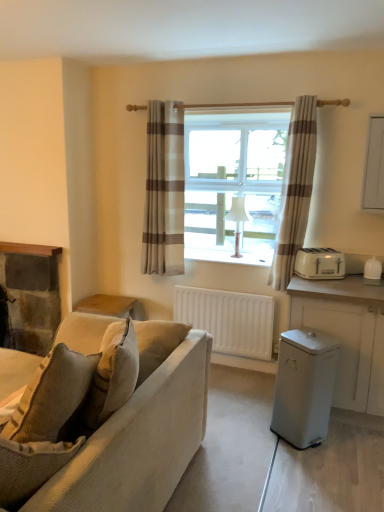
Identify the location of vacant space situated on the left part of white plastic trash can at lower right, which ranks as the second appliance in top-to-bottom order. The height and width of the screenshot is (512, 384). (255, 432).